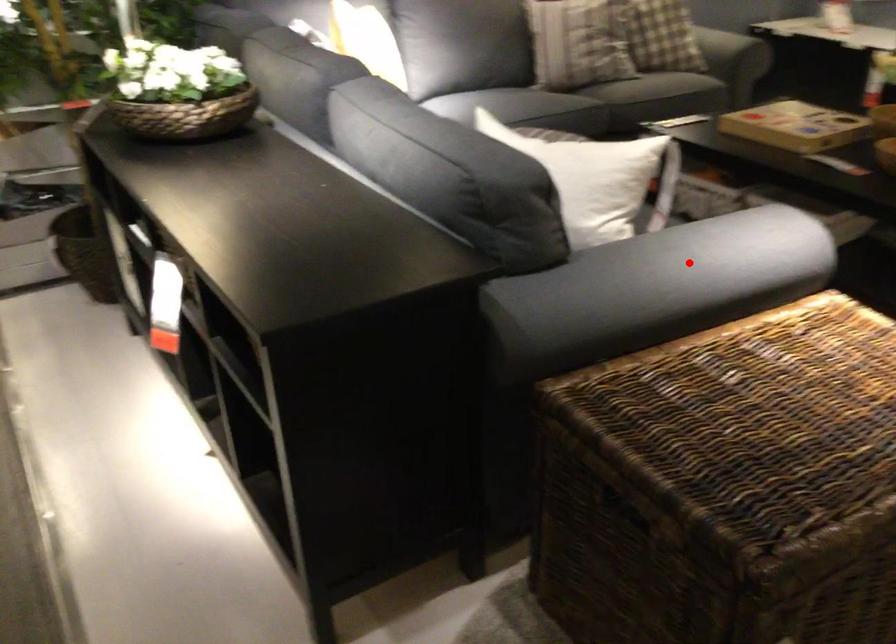
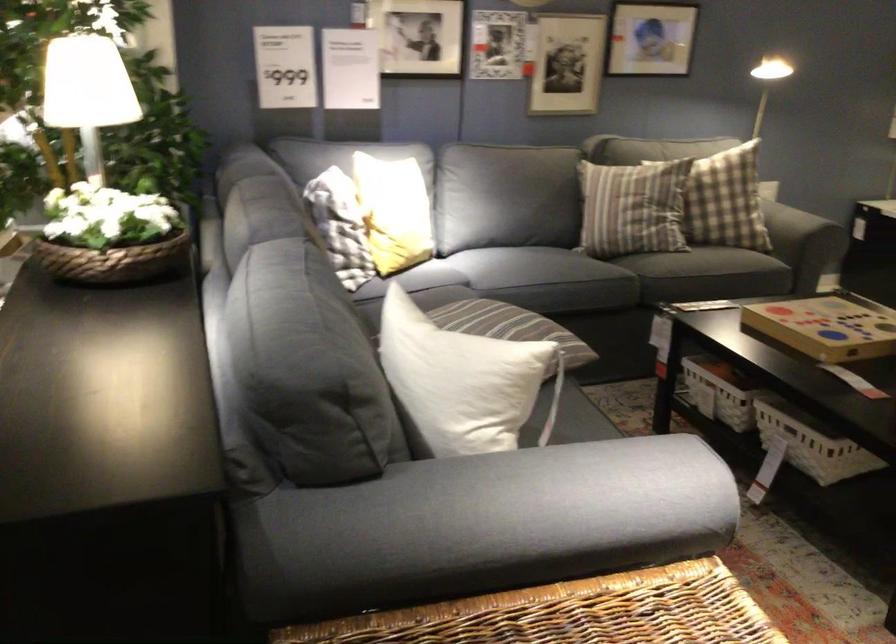
Question: I am providing you with two images of the same scene from different viewpoints. In image1, a red point is highlighted. Considering the same 3D point in image2, which of the following is correct?

Choices:
 (A) It is closer
 (B) It is farther

Answer: (A)